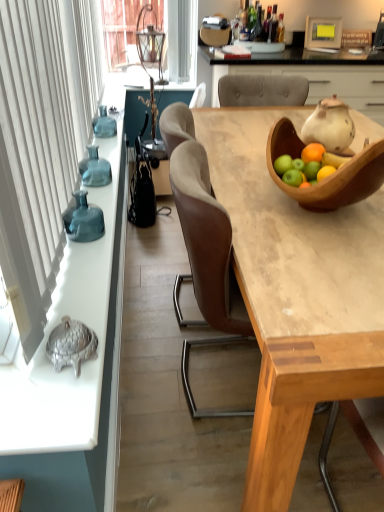
Question: From a real-world perspective, is translucent glass vase at left on wooden table at center?

Choices:
 (A) no
 (B) yes

Answer: (B)

Question: Is translucent glass vase at left positioned before wooden table at center?

Choices:
 (A) no
 (B) yes

Answer: (A)

Question: Is translucent glass vase at left at the left side of wooden table at center?

Choices:
 (A) yes
 (B) no

Answer: (A)

Question: Does translucent glass vase at left have a greater height compared to wooden table at center?

Choices:
 (A) no
 (B) yes

Answer: (A)

Question: From the image's perspective, does translucent glass vase at left appear lower than wooden table at center?

Choices:
 (A) no
 (B) yes

Answer: (A)

Question: From the image's perspective, is translucent glass vase at left on top of wooden table at center?

Choices:
 (A) yes
 (B) no

Answer: (A)

Question: Is the position of wooden bowl at upper right less distant than that of wooden cabinet at upper center?

Choices:
 (A) no
 (B) yes

Answer: (B)

Question: Is wooden bowl at upper right wider than wooden cabinet at upper center?

Choices:
 (A) no
 (B) yes

Answer: (A)

Question: Can you confirm if wooden bowl at upper right is thinner than wooden cabinet at upper center?

Choices:
 (A) no
 (B) yes

Answer: (B)

Question: Can you confirm if wooden bowl at upper right is taller than wooden cabinet at upper center?

Choices:
 (A) no
 (B) yes

Answer: (A)

Question: Is wooden bowl at upper right not near wooden cabinet at upper center?

Choices:
 (A) no
 (B) yes

Answer: (B)

Question: Is wooden bowl at upper right not inside wooden cabinet at upper center?

Choices:
 (A) no
 (B) yes

Answer: (B)

Question: Can you confirm if translucent glass vase at left is bigger than wooden bowl at upper right?

Choices:
 (A) yes
 (B) no

Answer: (B)